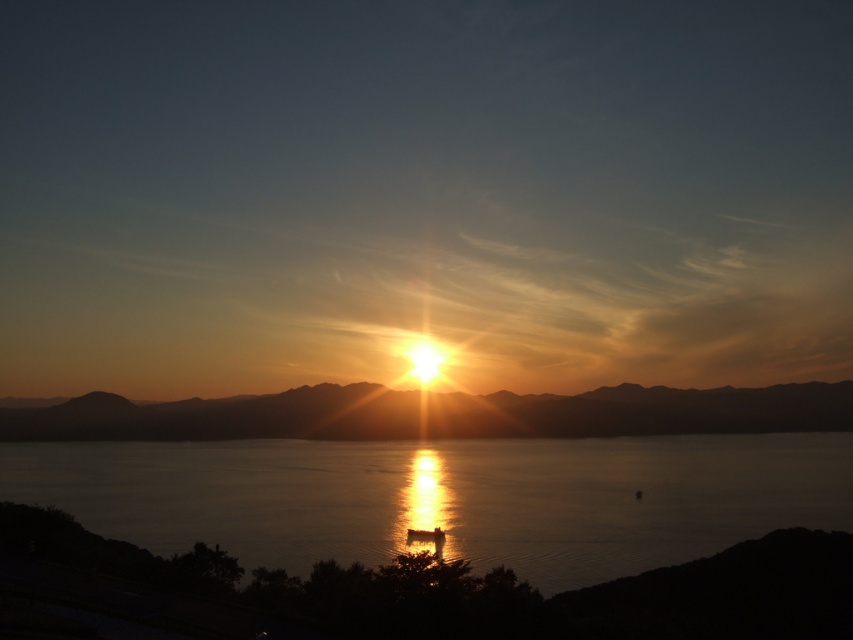
Where is `glistening reflective water at center`? This screenshot has width=853, height=640. glistening reflective water at center is located at coordinates (447, 497).

From the picture: Who is positioned more to the right, glistening reflective water at center or golden reflective water at center?

glistening reflective water at center is more to the right.

What do you see at coordinates (447, 497) in the screenshot?
I see `glistening reflective water at center` at bounding box center [447, 497].

Find the location of `glistening reflective water at center`. glistening reflective water at center is located at coordinates (447, 497).